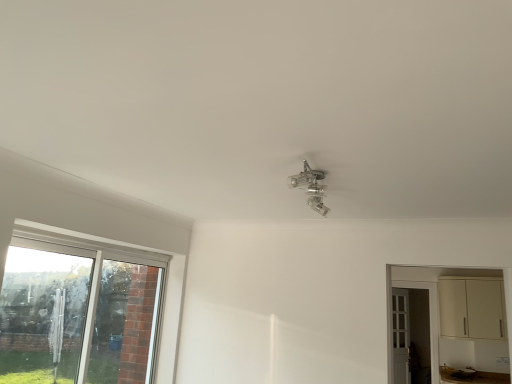
Question: Is cream matte cabinet at right not within clear glass window at lower left?

Choices:
 (A) no
 (B) yes

Answer: (B)

Question: Are cream matte cabinet at right and clear glass window at lower left making contact?

Choices:
 (A) yes
 (B) no

Answer: (B)

Question: Does cream matte cabinet at right have a greater width compared to clear glass window at lower left?

Choices:
 (A) yes
 (B) no

Answer: (A)

Question: Can you confirm if cream matte cabinet at right is bigger than clear glass window at lower left?

Choices:
 (A) yes
 (B) no

Answer: (A)

Question: From a real-world perspective, is cream matte cabinet at right physically below clear glass window at lower left?

Choices:
 (A) yes
 (B) no

Answer: (B)

Question: From a real-world perspective, is white wooden door at right positioned above or below cream matte cabinet at right?

Choices:
 (A) above
 (B) below

Answer: (B)

Question: Looking at their shapes, would you say white wooden door at right is wider or thinner than cream matte cabinet at right?

Choices:
 (A) wide
 (B) thin

Answer: (B)

Question: Is point (395, 291) closer or farther from the camera than point (426, 281)?

Choices:
 (A) farther
 (B) closer

Answer: (A)

Question: Considering the positions of white wooden door at right and cream matte cabinet at right in the image, is white wooden door at right taller or shorter than cream matte cabinet at right?

Choices:
 (A) tall
 (B) short

Answer: (A)

Question: From a real-world perspective, is clear plastic umbrella at left above or below clear glass window at lower left?

Choices:
 (A) above
 (B) below

Answer: (A)

Question: In the image, is clear plastic umbrella at left on the left side or the right side of clear glass window at lower left?

Choices:
 (A) left
 (B) right

Answer: (A)

Question: Is clear plastic umbrella at left bigger or smaller than clear glass window at lower left?

Choices:
 (A) big
 (B) small

Answer: (B)

Question: Is clear plastic umbrella at left in front of or behind clear glass window at lower left in the image?

Choices:
 (A) front
 (B) behind

Answer: (B)

Question: Is cream matte cabinet at right to the left or to the right of white wooden door at right in the image?

Choices:
 (A) left
 (B) right

Answer: (A)

Question: Considering their positions, is cream matte cabinet at right located in front of or behind white wooden door at right?

Choices:
 (A) front
 (B) behind

Answer: (A)